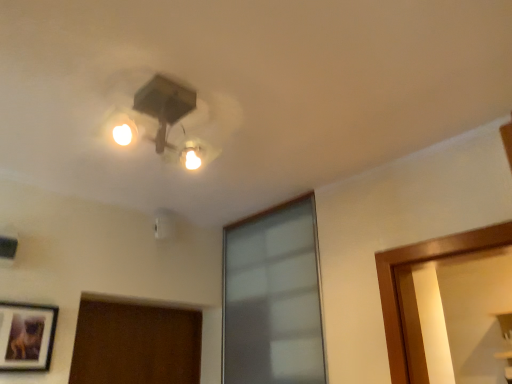
Question: Could you tell me if matte black picture frame at lower left is turned towards frosted glass window at center?

Choices:
 (A) no
 (B) yes

Answer: (A)

Question: Would you say matte black picture frame at lower left is a long distance from frosted glass window at center?

Choices:
 (A) yes
 (B) no

Answer: (A)

Question: From a real-world perspective, does matte black picture frame at lower left sit lower than frosted glass window at center?

Choices:
 (A) yes
 (B) no

Answer: (A)

Question: Is frosted glass window at center at the back of matte black picture frame at lower left?

Choices:
 (A) no
 (B) yes

Answer: (A)

Question: Can you confirm if matte black picture frame at lower left is taller than frosted glass window at center?

Choices:
 (A) no
 (B) yes

Answer: (A)

Question: Would you say frosted glass window at center is part of matte black picture frame at lower left's contents?

Choices:
 (A) yes
 (B) no

Answer: (B)

Question: Considering the relative positions of frosted glass window at center and matte black fixture at upper center in the image provided, is frosted glass window at center to the right of matte black fixture at upper center from the viewer's perspective?

Choices:
 (A) no
 (B) yes

Answer: (B)

Question: Is frosted glass window at center oriented away from matte black fixture at upper center?

Choices:
 (A) no
 (B) yes

Answer: (A)

Question: From the image's perspective, is frosted glass window at center below matte black fixture at upper center?

Choices:
 (A) no
 (B) yes

Answer: (B)

Question: From a real-world perspective, is frosted glass window at center below matte black fixture at upper center?

Choices:
 (A) yes
 (B) no

Answer: (A)

Question: Does frosted glass window at center come in front of matte black fixture at upper center?

Choices:
 (A) yes
 (B) no

Answer: (B)

Question: Is frosted glass window at center facing towards matte black fixture at upper center?

Choices:
 (A) no
 (B) yes

Answer: (B)

Question: Is frosted glass window at center facing towards matte black picture frame at lower left?

Choices:
 (A) yes
 (B) no

Answer: (A)